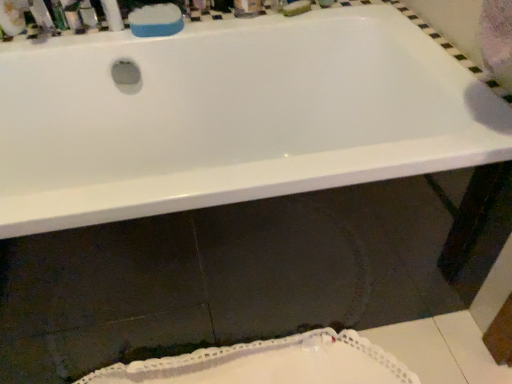
Question: Does metallic silver container at upper left, which is the 3th toiletry from left to right, have a larger size compared to white glossy bathtub at upper center?

Choices:
 (A) no
 (B) yes

Answer: (A)

Question: From the image's perspective, is metallic silver container at upper left, which is the 3th toiletry from left to right, located beneath white glossy bathtub at upper center?

Choices:
 (A) yes
 (B) no

Answer: (B)

Question: Is metallic silver container at upper left, which is the 1th toiletry from right to left, wider than white glossy bathtub at upper center?

Choices:
 (A) no
 (B) yes

Answer: (A)

Question: Is metallic silver container at upper left, which is the 3th toiletry from left to right, thinner than white glossy bathtub at upper center?

Choices:
 (A) no
 (B) yes

Answer: (B)

Question: Considering the relative positions of metallic silver container at upper left, which is the 3th toiletry from left to right, and white glossy bathtub at upper center in the image provided, is metallic silver container at upper left, which is the 3th toiletry from left to right, to the right of white glossy bathtub at upper center from the viewer's perspective?

Choices:
 (A) no
 (B) yes

Answer: (A)

Question: From a real-world perspective, is metallic silver soap at upper left, which is counted as the first toiletry, starting from the left, positioned above or below white lace doily at lower center?

Choices:
 (A) below
 (B) above

Answer: (B)

Question: Relative to white lace doily at lower center, is metallic silver soap at upper left, the third toiletry viewed from the right, in front or behind?

Choices:
 (A) behind
 (B) front

Answer: (A)

Question: Is point (54, 21) closer or farther from the camera than point (139, 365)?

Choices:
 (A) farther
 (B) closer

Answer: (A)

Question: In terms of height, does metallic silver soap at upper left, which is counted as the first toiletry, starting from the left, look taller or shorter compared to white lace doily at lower center?

Choices:
 (A) short
 (B) tall

Answer: (A)

Question: Relative to matte plastic toothbrush at upper left, the 2th toiletry in the left-to-right sequence, is white lace doily at lower center in front or behind?

Choices:
 (A) behind
 (B) front

Answer: (B)

Question: From the image's perspective, is white lace doily at lower center positioned above or below matte plastic toothbrush at upper left, acting as the second toiletry starting from the right?

Choices:
 (A) below
 (B) above

Answer: (A)

Question: From a real-world perspective, is white lace doily at lower center positioned above or below matte plastic toothbrush at upper left, the 2th toiletry in the left-to-right sequence?

Choices:
 (A) below
 (B) above

Answer: (A)

Question: Is point (279, 379) closer or farther from the camera than point (74, 28)?

Choices:
 (A) closer
 (B) farther

Answer: (A)

Question: Choose the correct answer: Is white glossy bathtub at upper center inside blue sponge at upper center or outside it?

Choices:
 (A) outside
 (B) inside

Answer: (A)

Question: From the image's perspective, is white glossy bathtub at upper center positioned above or below blue sponge at upper center?

Choices:
 (A) below
 (B) above

Answer: (A)